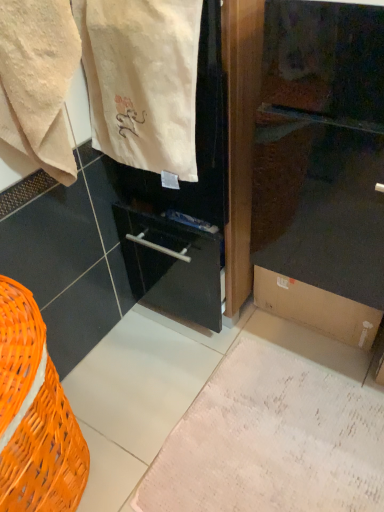
Question: Is beige cotton towel at upper left in front of or behind orange wicker basket at lower left in the image?

Choices:
 (A) front
 (B) behind

Answer: (B)

Question: From a real-world perspective, is beige cotton towel at upper left physically located above or below orange wicker basket at lower left?

Choices:
 (A) above
 (B) below

Answer: (A)

Question: Which object is the farthest from the orange wicker basket at lower left?

Choices:
 (A) white textured rug at lower center
 (B) beige cotton towel at upper left
 (C) brown cardboard box at lower right
 (D) beige cotton towel at upper left

Answer: (C)

Question: Which of these objects is positioned farthest from the beige cotton towel at upper left?

Choices:
 (A) beige cotton towel at upper left
 (B) white textured rug at lower center
 (C) orange wicker basket at lower left
 (D) brown cardboard box at lower right

Answer: (B)